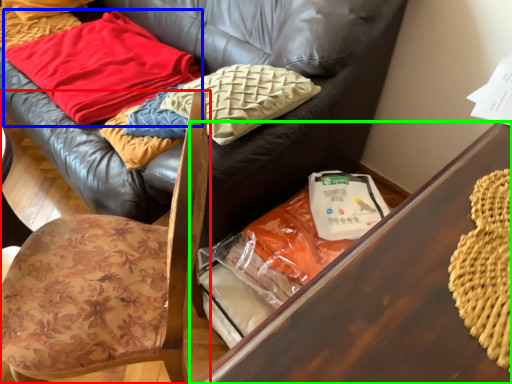
Question: Which object is positioned farthest from chair (highlighted by a red box)? Select from blanket (highlighted by a blue box) and table (highlighted by a green box).

Choices:
 (A) blanket
 (B) table

Answer: (A)